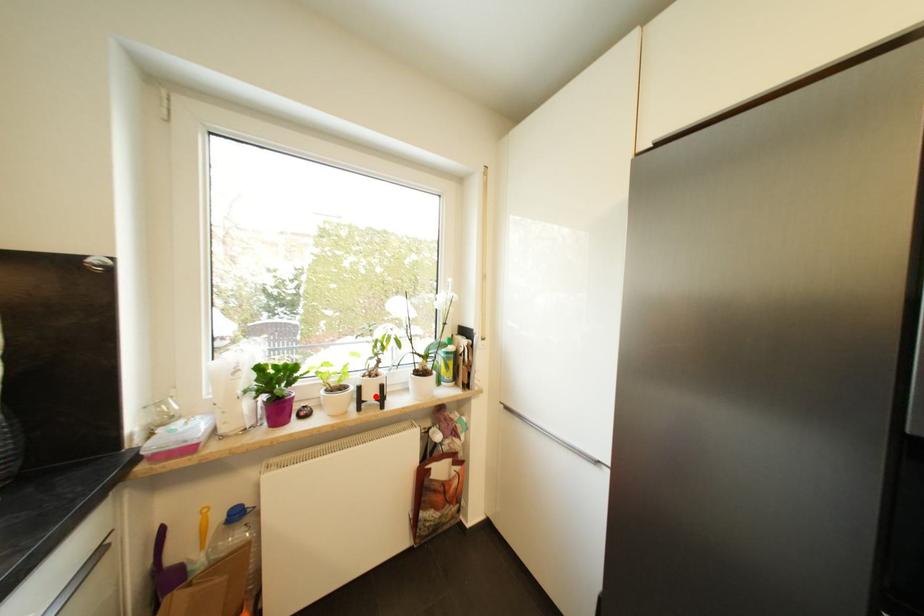
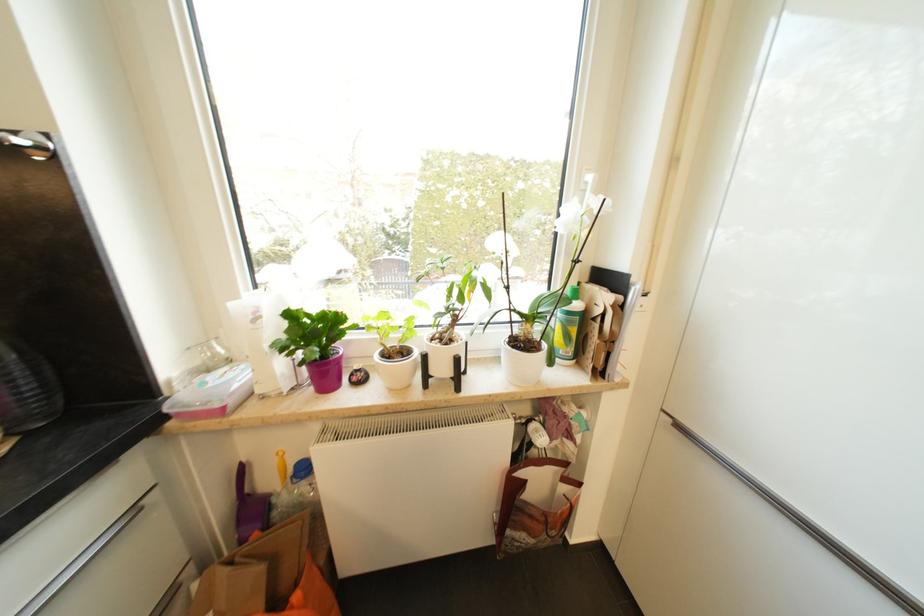
In the second image, find the point that corresponds to the highlighted location in the first image.

(446, 371)